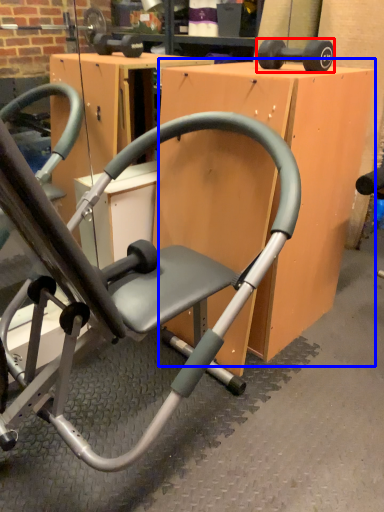
Question: Which of the following is the closest to the observer, dumbbell (highlighted by a red box) or table (highlighted by a blue box)?

Choices:
 (A) dumbbell
 (B) table

Answer: (B)